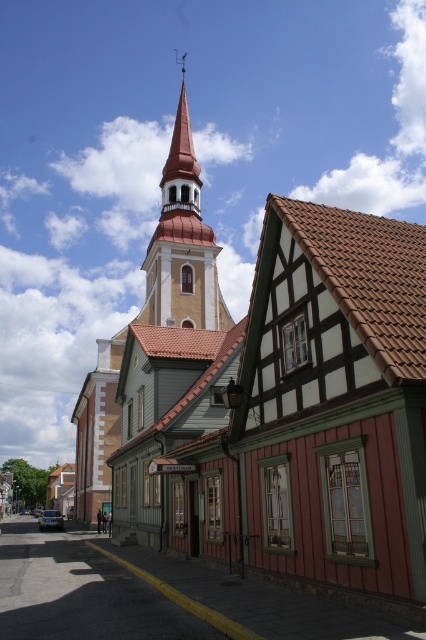
You are an architect analyzing the street scene. You need to determine which structure has a larger footprint. Based on the image, which one is bigger between the matte yellow church steeple at upper left and the smooth orange spire at center?

The matte yellow church steeple at upper left has a larger size compared to the smooth orange spire at center, so it has a larger footprint.

You are a bird flying over the street scene and want to land on the tallest structure. Which structure should you choose between the smooth orange steeple at center and the smooth orange spire at center?

The smooth orange steeple at center is much taller than the smooth orange spire at center, so you should choose the smooth orange steeple at center to land on.